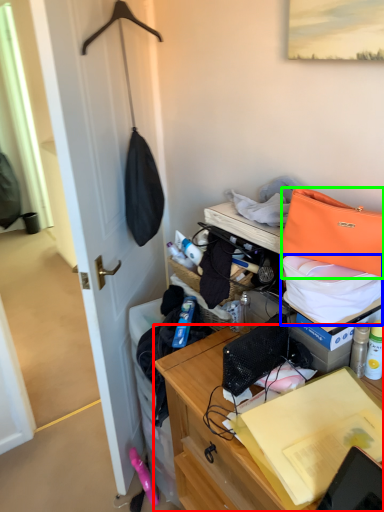
Question: Based on their relative distances, which object is nearer to desk (highlighted by a red box)? Choose from kit (highlighted by a blue box) and handbag (highlighted by a green box).

Choices:
 (A) kit
 (B) handbag

Answer: (A)